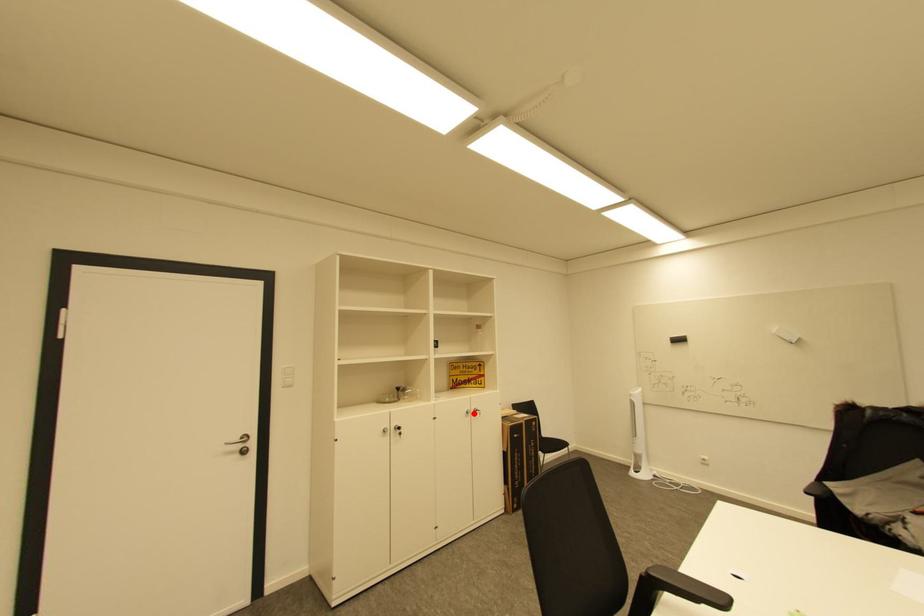
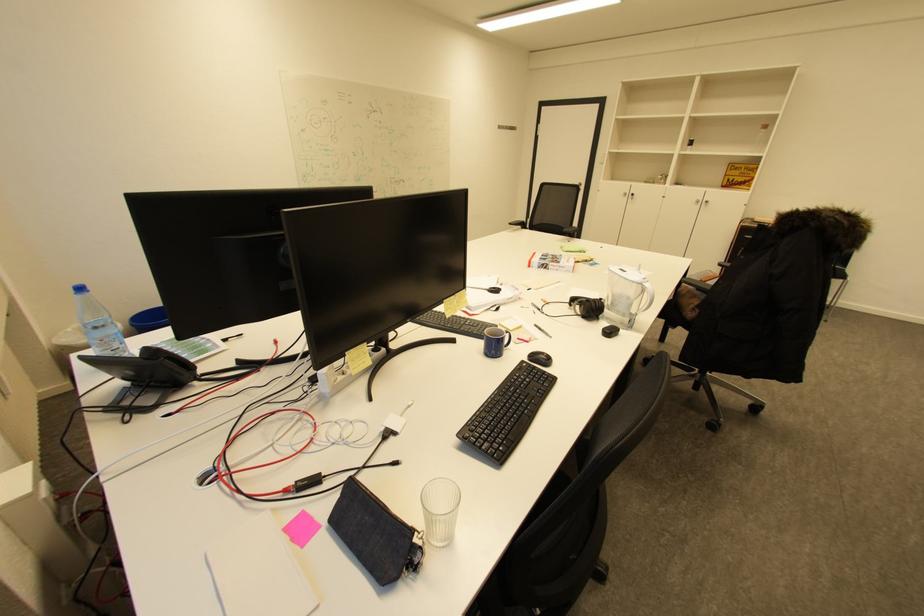
Question: I am providing you with two images of the same scene from different viewpoints. In image1, a red point is highlighted. Considering the same 3D point in image2, which of the following is correct?

Choices:
 (A) It is closer
 (B) It is farther

Answer: (A)